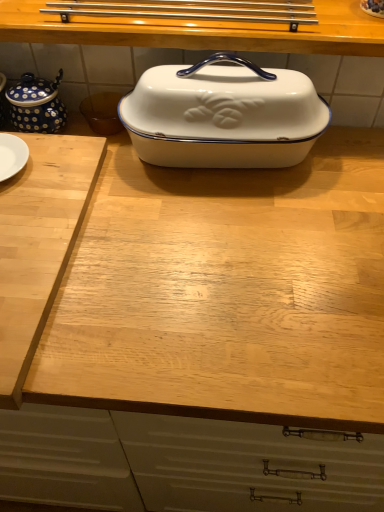
I want to click on free space that is to the left of blue polka dot ceramic jar at upper left, so click(335, 14).